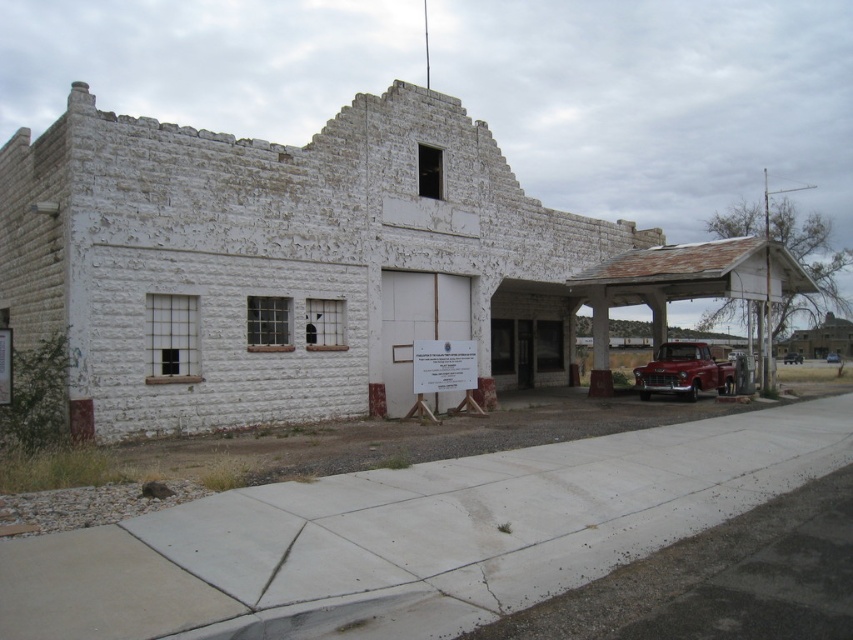
Does shiny red truck at center have a lesser height compared to metallic silver pickup truck at right?

No, shiny red truck at center is not shorter than metallic silver pickup truck at right.

Can you confirm if shiny red truck at center is bigger than metallic silver pickup truck at right?

Yes.

In order to click on shiny red truck at center in this screenshot , I will do `click(683, 371)`.

Where is `shiny red truck at center`? The image size is (853, 640). shiny red truck at center is located at coordinates (683, 371).

Which is in front, point (801, 362) or point (833, 355)?

Point (801, 362) is in front.

Who is more distant from viewer, (799, 358) or (827, 356)?

Point (827, 356)

Does point (796, 362) come in front of point (827, 356)?

Yes.

You are a GUI agent. You are given a task and a screenshot of the screen. Output one action in this format:
    pyautogui.click(x=<x>, y=<y>)
    Task: Click on the metallic silver pickup truck at right
    This screenshot has height=640, width=853.
    Given the screenshot: What is the action you would take?
    pyautogui.click(x=792, y=356)

Can you confirm if shiny red truck at center is positioned above metallic silver truck at right?

Correct, shiny red truck at center is located above metallic silver truck at right.

Is point (726, 381) farther from viewer compared to point (836, 353)?

No.

The image size is (853, 640). Identify the location of shiny red truck at center. (683, 371).

Image resolution: width=853 pixels, height=640 pixels. I want to click on shiny red truck at center, so [x=683, y=371].